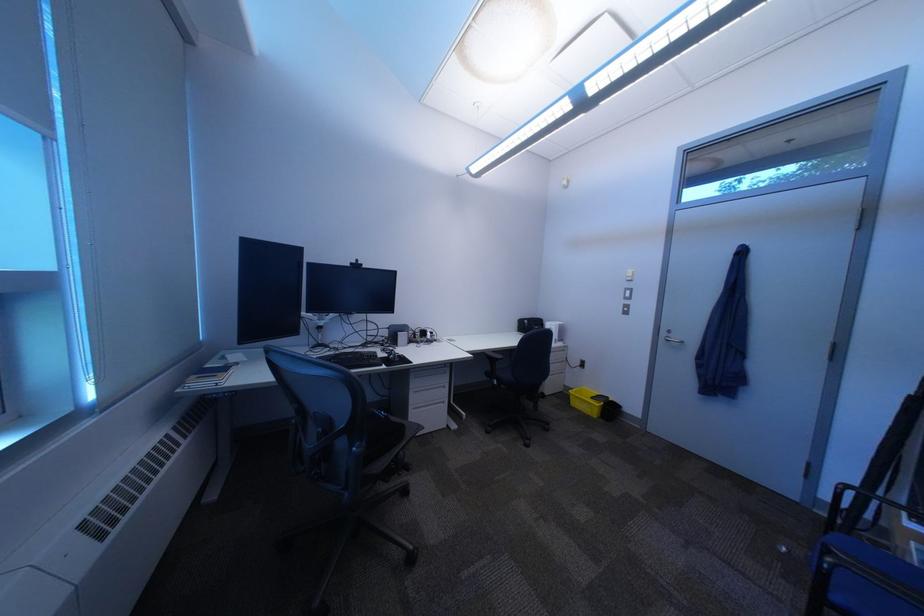
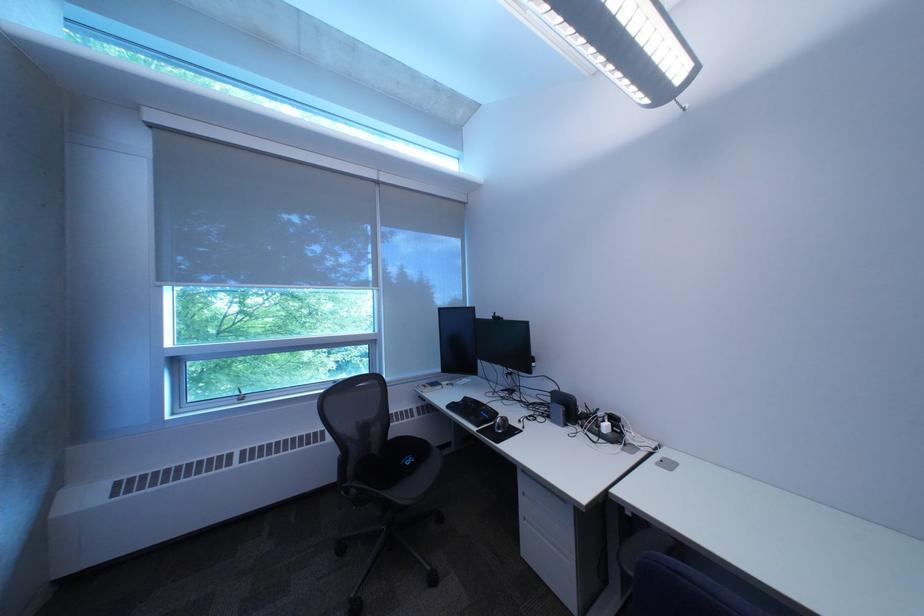
Where in the second image is the point corresponding to (371,334) from the first image?

(532, 387)